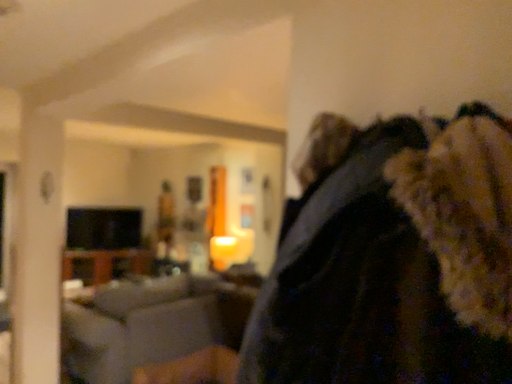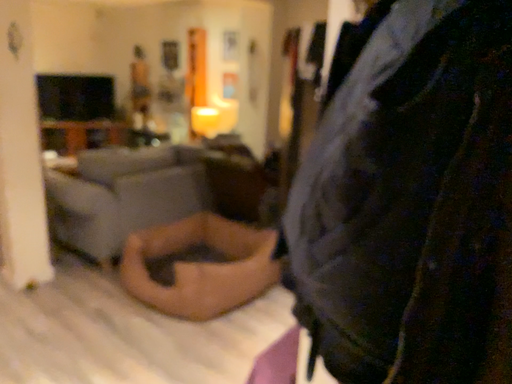
Question: How did the camera likely rotate when shooting the video?

Choices:
 (A) rotated upward
 (B) rotated downward

Answer: (B)